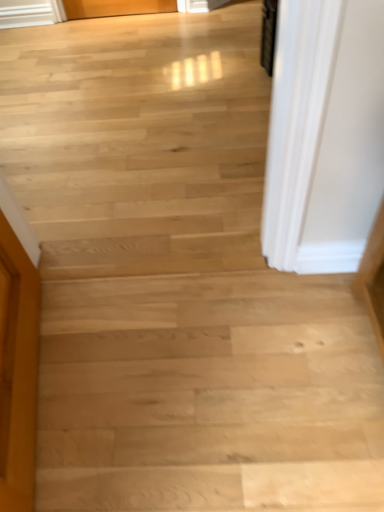
You are a GUI agent. You are given a task and a screenshot of the screen. Output one action in this format:
    pyautogui.click(x=<x>, y=<y>)
    Task: Click on the vacant region above natural wood stairs at center (from a real-world perspective)
    The width and height of the screenshot is (384, 512).
    Given the screenshot: What is the action you would take?
    pyautogui.click(x=231, y=400)